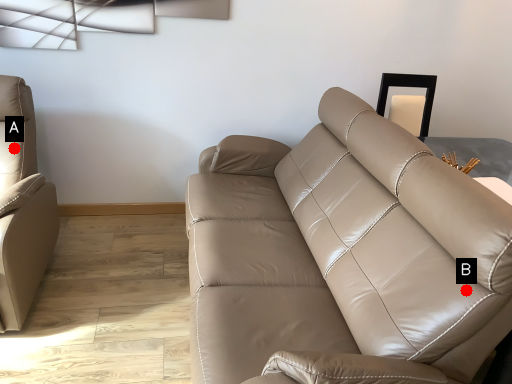
Question: Two points are circled on the image, labeled by A and B beside each circle. Which point is closer to the camera?

Choices:
 (A) A is closer
 (B) B is closer

Answer: (B)